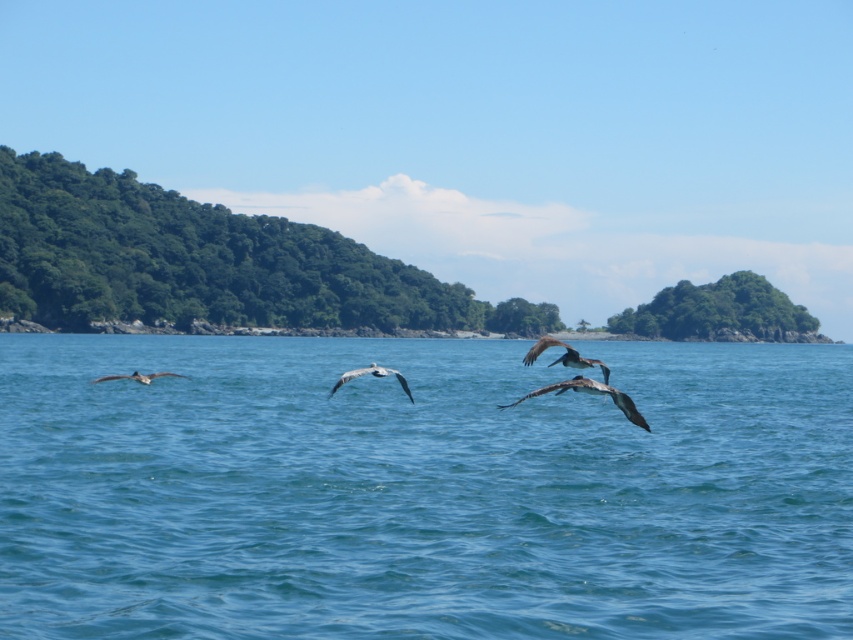
Is gray matte pelican at center further to camera compared to gray feathered pelican at center?

No, gray matte pelican at center is closer to the viewer.

Is gray matte pelican at center wider than gray feathered pelican at center?

No, gray matte pelican at center is not wider than gray feathered pelican at center.

Between point (544, 336) and point (329, 394), which one is positioned in front?

Point (329, 394) is more forward.

The width and height of the screenshot is (853, 640). Find the location of `gray matte pelican at center`. gray matte pelican at center is located at coordinates (564, 356).

Describe the element at coordinates (421, 490) in the screenshot. I see `blue water at center` at that location.

Which of these two, blue water at center or gray feathered bird at center, stands taller?

blue water at center

Which is in front, point (500, 557) or point (529, 396)?

Point (500, 557) is in front.

I want to click on blue water at center, so click(421, 490).

Does blue water at center appear on the left side of gray matte pelican at center?

In fact, blue water at center is to the right of gray matte pelican at center.

Measure the distance from blue water at center to gray matte pelican at center.

A distance of 120.89 feet exists between blue water at center and gray matte pelican at center.

Between point (666, 568) and point (541, 342), which one is positioned in front?

Point (666, 568) is in front.

At what (x,y) coordinates should I click in order to perform the action: click on blue water at center. Please return your answer as a coordinate pair (x, y). This screenshot has height=640, width=853. Looking at the image, I should click on (421, 490).